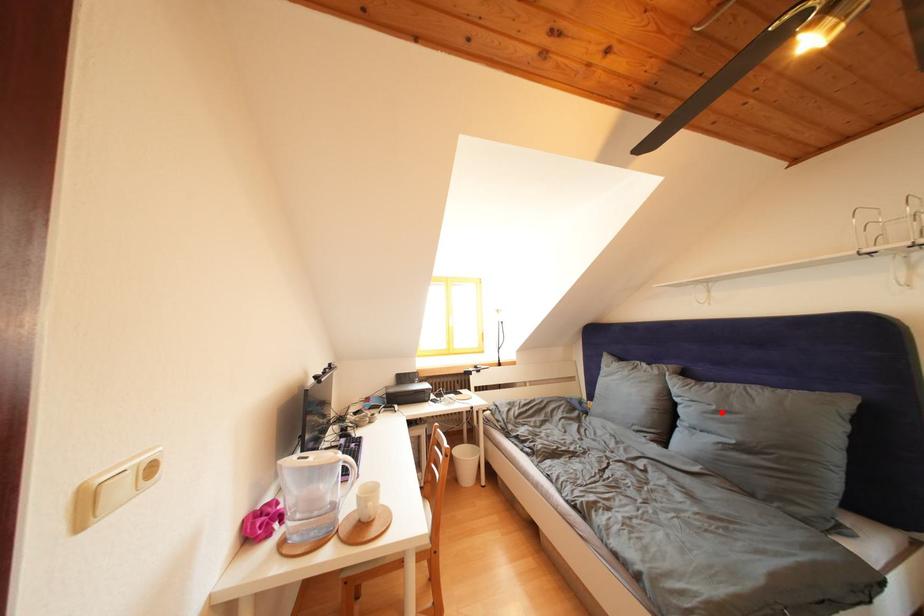
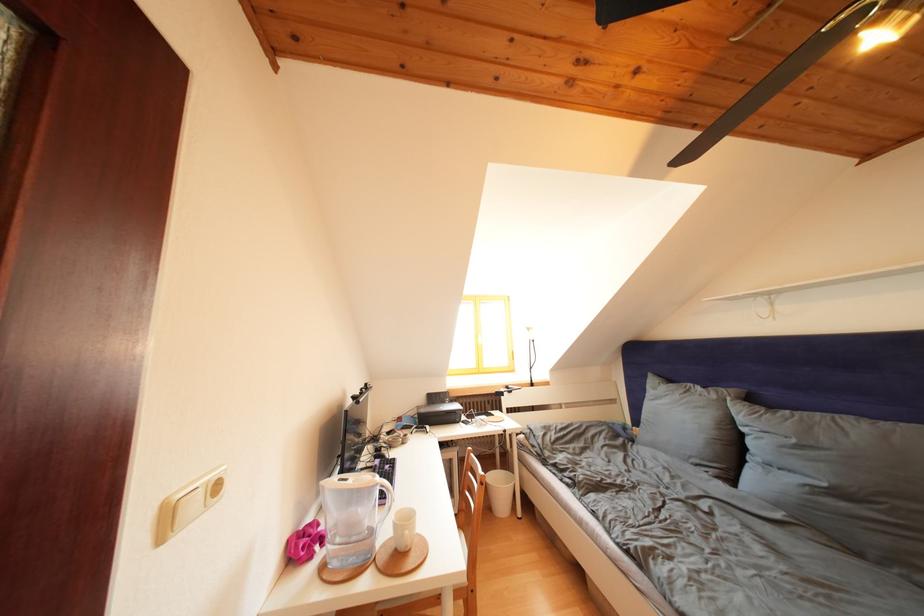
The point at the highlighted location is marked in the first image. Where is the corresponding point in the second image?

(801, 446)